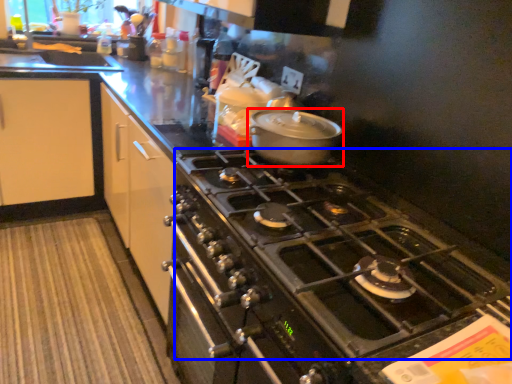
Question: Among these objects, which one is nearest to the camera, kitchen appliance (highlighted by a red box) or gas stove (highlighted by a blue box)?

Choices:
 (A) kitchen appliance
 (B) gas stove

Answer: (B)